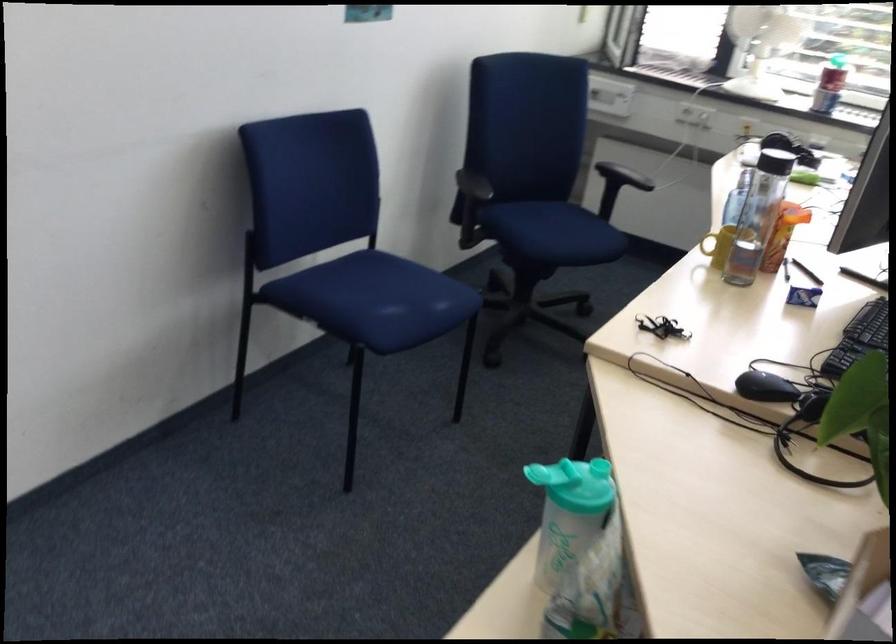
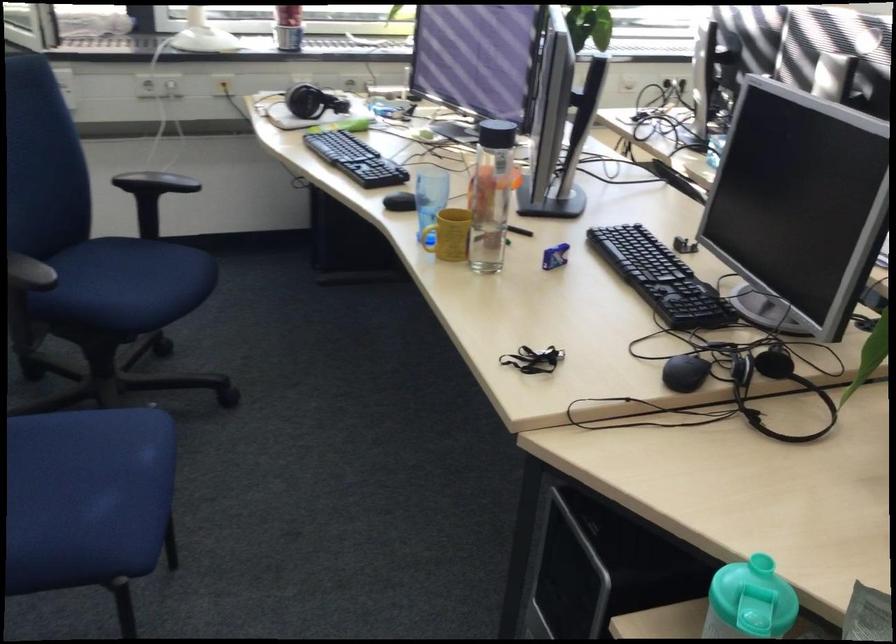
Question: The camera is either moving clockwise (left) or counter-clockwise (right) around the object. The first image is from the beginning of the video and the second image is from the end. Is the camera moving left or right when shooting the video?

Choices:
 (A) Left
 (B) Right

Answer: (A)